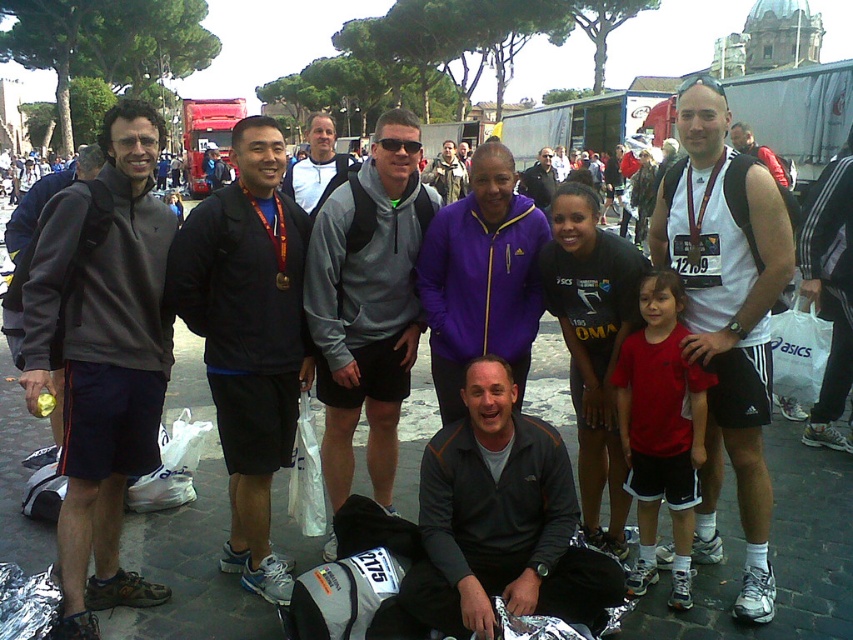
Which is above, dark gray fleece jacket at left or gray fleece jacket at center?

gray fleece jacket at center is higher up.

Is point (67, 550) farther from camera compared to point (323, 166)?

No.

You are a GUI agent. You are given a task and a screenshot of the screen. Output one action in this format:
    pyautogui.click(x=<x>, y=<y>)
    Task: Click on the dark gray fleece jacket at left
    
    Given the screenshot: What is the action you would take?
    pyautogui.click(x=102, y=355)

Between point (699, 125) and point (299, 316), which one is positioned in front?

Point (699, 125) is more forward.

Is white matte tank top at center to the right of dark gray sweatshirt at center from the viewer's perspective?

Yes, white matte tank top at center is to the right of dark gray sweatshirt at center.

Image resolution: width=853 pixels, height=640 pixels. What are the coordinates of `white matte tank top at center` in the screenshot? It's located at (726, 316).

Who is shorter, dark gray fleece jacket at center or gray fleece hoodie at center?

dark gray fleece jacket at center is shorter.

Is point (473, 410) closer to camera compared to point (415, 243)?

Yes, it is.

This screenshot has width=853, height=640. Find the location of `dark gray fleece jacket at center`. dark gray fleece jacket at center is located at coordinates coord(496,524).